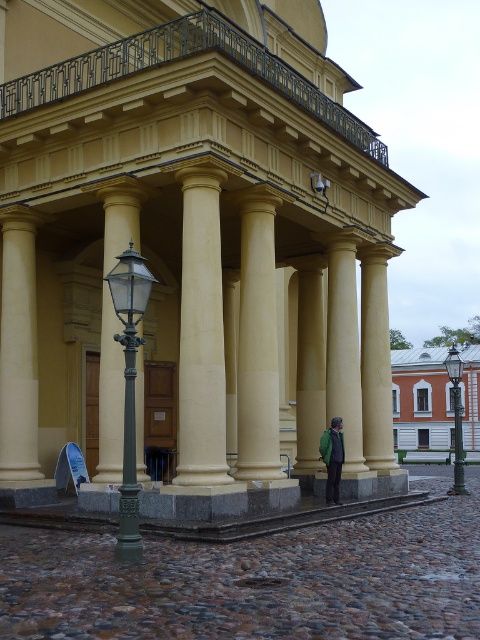
You are a visitor approaching the orange painted wood palace at center and notice the green polished metal lamp post at left. Which object is closer to you as you walk towards the palace?

The orange painted wood palace at center is closer to you because the green polished metal lamp post at left is positioned behind it, meaning the palace is in front from your perspective.

You are standing in front of the classical building and want to place a small statue between the two points labeled as point (254, 262) and point (443, 448). Which point should the statue be closer to in order to be nearer to the entrance?

The statue should be placed closer to point (254, 262) since it is closer to the viewer compared to point (443, 448), making it nearer to the entrance.